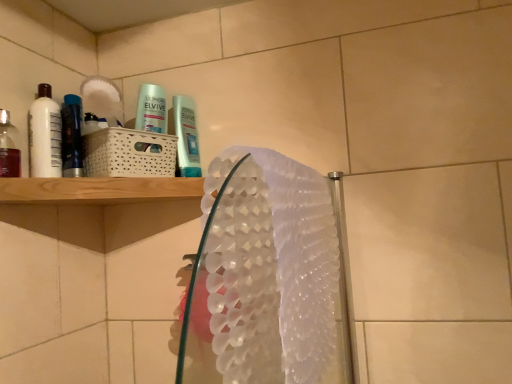
Question: Is point pos(62,158) closer or farther from the camera than point pos(2,132)?

Choices:
 (A) farther
 (B) closer

Answer: (A)

Question: From their relative heights in the image, would you say metallic blue mouthwash at left, acting as the third mouthwash starting from the front, is taller or shorter than translucent plastic mouthwash at left, which appears as the third mouthwash when viewed from the back?

Choices:
 (A) short
 (B) tall

Answer: (B)

Question: Estimate the real-world distances between objects in this image. Which object is farther from the translucent plastic mouthwash at left, which appears as the third mouthwash when viewed from the back?

Choices:
 (A) metallic blue mouthwash at left, which is the first mouthwash from back to front
 (B) white textured hand towel at center
 (C) white glossy mouthwash at left, the second mouthwash from the front

Answer: (B)

Question: Which object is the farthest from the metallic blue mouthwash at left, which is the first mouthwash from back to front?

Choices:
 (A) white glossy mouthwash at left, the second mouthwash from the back
 (B) white textured hand towel at center
 (C) translucent plastic mouthwash at left, which appears as the third mouthwash when viewed from the back

Answer: (B)